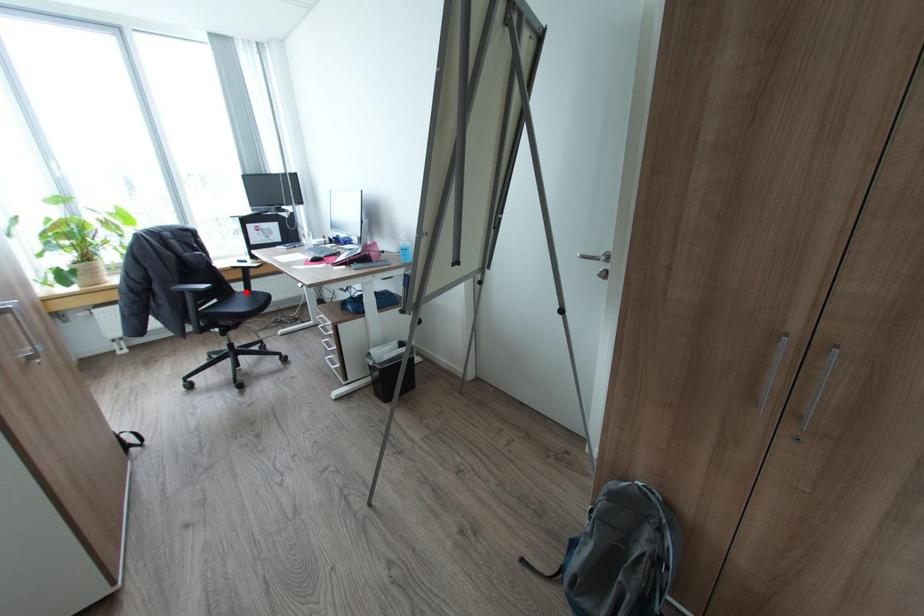
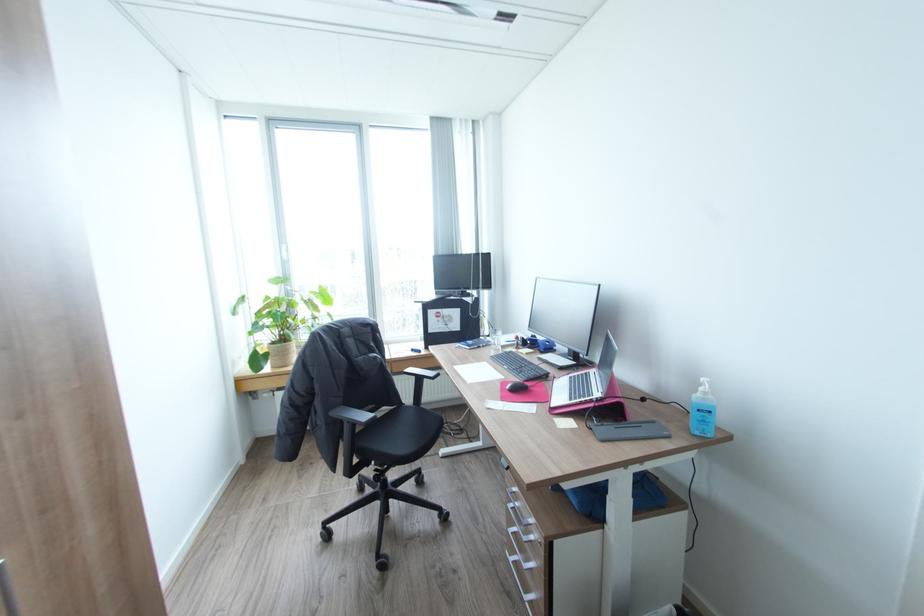
Where in the second image is the point corresponding to the highlighted location from the first image?

(412, 407)